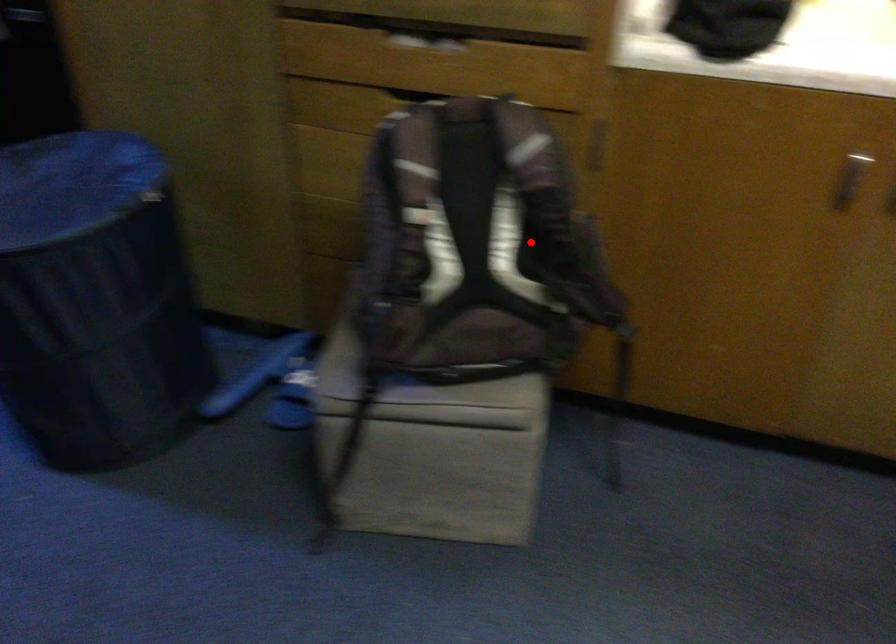
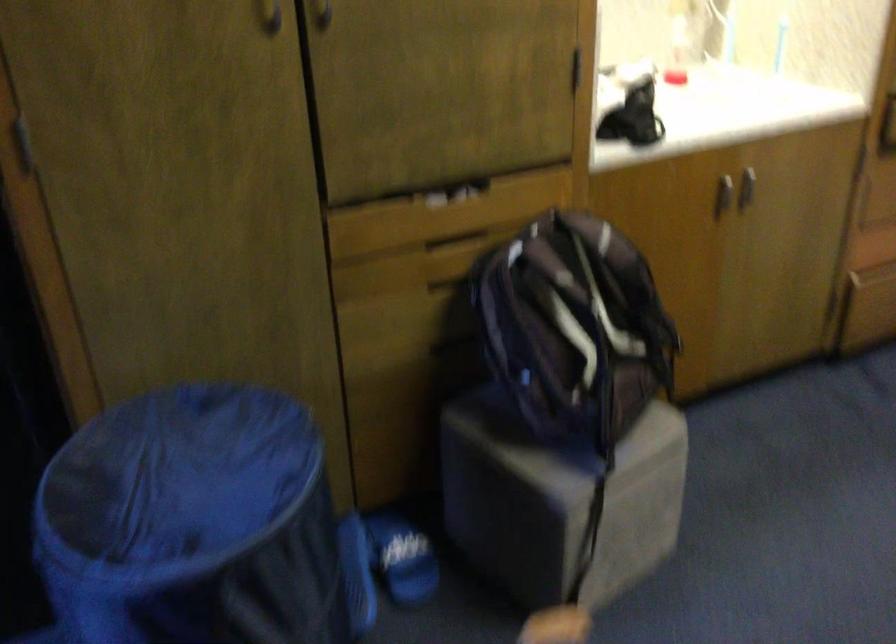
Question: I am providing you with two images of the same scene from different viewpoints. Given a red point in image1, look at the same physical point in image2. Is it:

Choices:
 (A) Closer to the viewpoint
 (B) Farther from the viewpoint

Answer: (B)